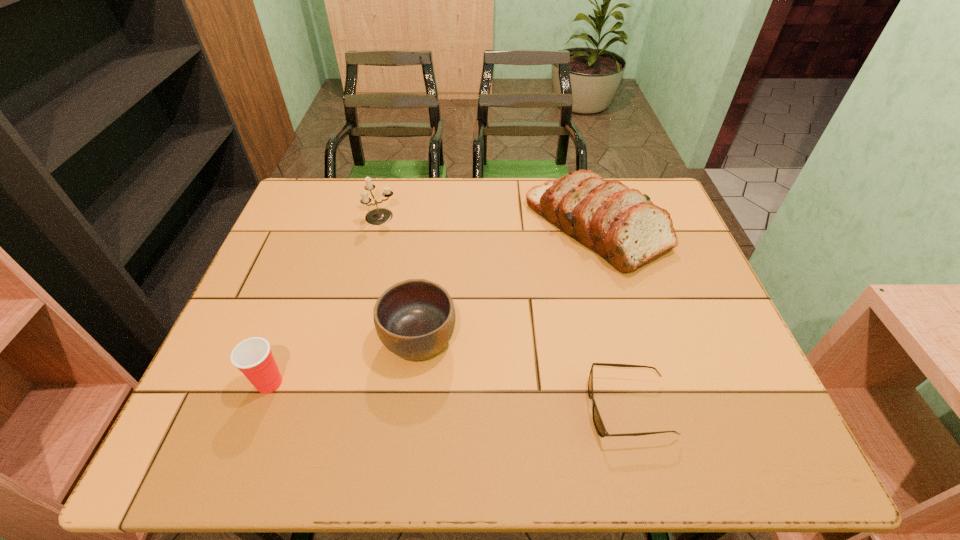
Locate an element on the screen. blank area at the left edge is located at coordinates (225, 381).

Locate an element on the screen. The image size is (960, 540). vacant space at the right edge of the desktop is located at coordinates (677, 359).

Locate an element on the screen. The height and width of the screenshot is (540, 960). empty space between the sunglasses and the Dixie cup is located at coordinates (449, 395).

Where is `unoccupied position between the third object from left to right and the candle holder`? unoccupied position between the third object from left to right and the candle holder is located at coordinates (400, 278).

Where is `unoccupied area between the shortest object and the bread`? unoccupied area between the shortest object and the bread is located at coordinates (612, 318).

Locate an element on the screen. empty space between the leftmost object and the candle holder is located at coordinates (325, 300).

The image size is (960, 540). I want to click on free space between the leftmost object and the sunglasses, so click(449, 395).

Where is `unoccupied position between the bread and the shortest object`? Image resolution: width=960 pixels, height=540 pixels. unoccupied position between the bread and the shortest object is located at coordinates (612, 318).

The image size is (960, 540). I want to click on free point between the shortest object and the bowl, so click(x=524, y=374).

Locate an element on the screen. The height and width of the screenshot is (540, 960). object that can be found as the third closest to the Dixie cup is located at coordinates (622, 225).